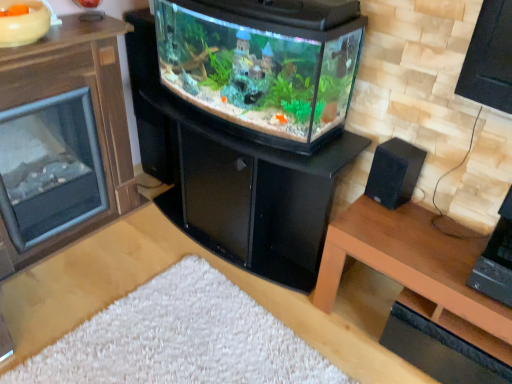
You are a GUI agent. You are given a task and a screenshot of the screen. Output one action in this format:
    pyautogui.click(x=<x>, y=<y>)
    Task: Click on the vacant area located to the right-hand side of brown wood fireplace at left
    
    Given the screenshot: What is the action you would take?
    pyautogui.click(x=141, y=263)